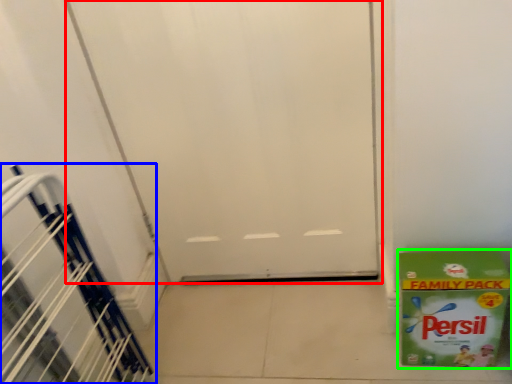
Question: Which is nearer to the door (highlighted by a red box)? stairwell (highlighted by a blue box) or box (highlighted by a green box).

Choices:
 (A) stairwell
 (B) box

Answer: (B)